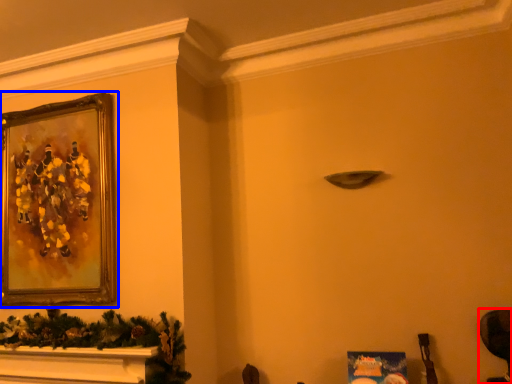
Question: Which object appears farthest to the camera in this image, swivel chair (highlighted by a red box) or picture frame (highlighted by a blue box)?

Choices:
 (A) swivel chair
 (B) picture frame

Answer: (B)